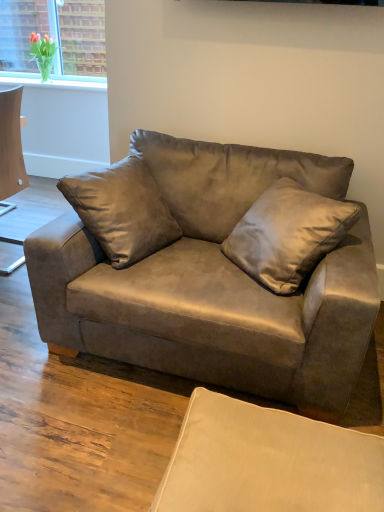
Question: Would you say satin brown pillow at center is inside or outside suede couch at center?

Choices:
 (A) outside
 (B) inside

Answer: (B)

Question: Does point (233, 248) appear closer or farther from the camera than point (200, 180)?

Choices:
 (A) farther
 (B) closer

Answer: (B)

Question: Based on their relative distances, which object is nearer to the satin brown pillow at center?

Choices:
 (A) suede couch at center
 (B) beige fabric swivel chair at lower right

Answer: (A)

Question: Estimate the real-world distances between objects in this image. Which object is closer to the beige fabric swivel chair at lower right?

Choices:
 (A) suede couch at center
 (B) satin brown pillow at center

Answer: (A)